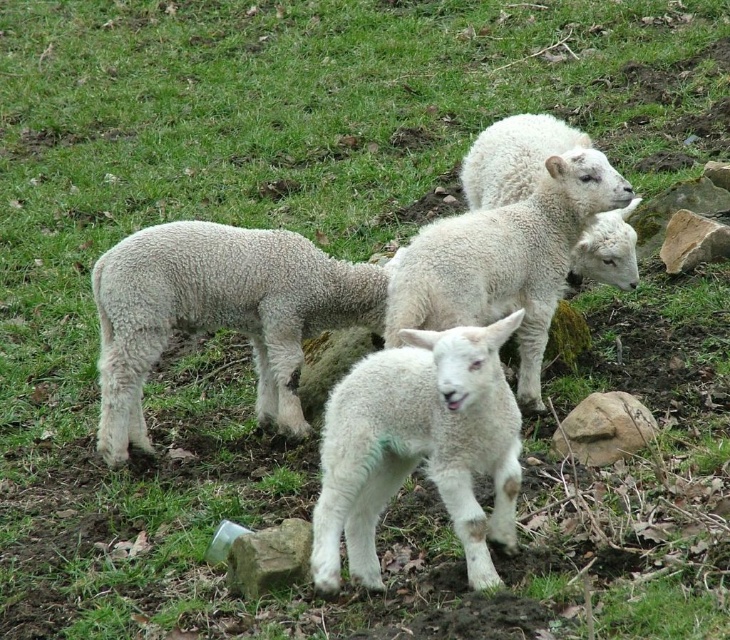
You are a photographer standing at the camera position. You want to take a closeup shot of the brown rough rock at lower right. Can you reach it without moving from your current position if your longest lens has a 200mm focal length?

The brown rough rock at lower right is 3.92 meters away from the camera. With a 200mm lens, you can capture a closeup shot from that distance without needing to move closer.

You are standing at the point labeled point (261,550) and want to walk to the point labeled point (618,392). Given the scene with lambs and obstacles, will you have to move forward or backward to reach your destination?

To reach point (618,392) from point (261,550), you will need to move forward because point (618,392) is behind point (261,550), meaning it is in the direction you are facing as you move forward.